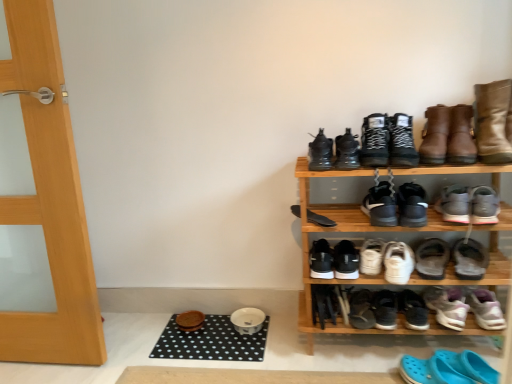
Question: Does gray suede sneakers at center right, the 13th footwear ordered from the bottom, contain blue rubber clogs at lower right, arranged as the 20th footwear when viewed from the top?

Choices:
 (A) yes
 (B) no

Answer: (B)

Question: Considering the relative sizes of gray suede sneakers at center right, the 13th footwear ordered from the bottom, and blue rubber clogs at lower right, arranged as the 20th footwear when viewed from the top, in the image provided, is gray suede sneakers at center right, the 13th footwear ordered from the bottom, smaller than blue rubber clogs at lower right, arranged as the 20th footwear when viewed from the top,?

Choices:
 (A) no
 (B) yes

Answer: (B)

Question: Considering the relative positions of gray suede sneakers at center right, which appears as the eighth footwear when viewed from the top, and blue rubber clogs at lower right, arranged as the 20th footwear when viewed from the top, in the image provided, is gray suede sneakers at center right, which appears as the eighth footwear when viewed from the top, to the right of blue rubber clogs at lower right, arranged as the 20th footwear when viewed from the top, from the viewer's perspective?

Choices:
 (A) no
 (B) yes

Answer: (B)

Question: Is gray suede sneakers at center right, the 13th footwear ordered from the bottom, positioned before blue rubber clogs at lower right, arranged as the 20th footwear when viewed from the top?

Choices:
 (A) yes
 (B) no

Answer: (B)

Question: Could you tell me if gray suede sneakers at center right, the 13th footwear ordered from the bottom, is facing blue rubber clogs at lower right, which is the 1th footwear from bottom to top?

Choices:
 (A) no
 (B) yes

Answer: (A)

Question: Is gray suede sneakers at center right, the 13th footwear ordered from the bottom, located outside blue rubber clogs at lower right, which is the 1th footwear from bottom to top?

Choices:
 (A) no
 (B) yes

Answer: (B)

Question: Is black matte shoe at lower center, the 14th footwear positioned from the top, shorter than leather boots at upper right, placed as the 20th footwear when sorted from bottom to top?

Choices:
 (A) yes
 (B) no

Answer: (A)

Question: Is leather boots at upper right, the first footwear positioned from the top, at the back of black matte shoe at lower center, the 14th footwear positioned from the top?

Choices:
 (A) no
 (B) yes

Answer: (A)

Question: From a real-world perspective, is black matte shoe at lower center, the 14th footwear positioned from the top, physically above leather boots at upper right, placed as the 20th footwear when sorted from bottom to top?

Choices:
 (A) yes
 (B) no

Answer: (B)

Question: Considering the relative sizes of black matte shoe at lower center, the seventh footwear when ordered from bottom to top, and leather boots at upper right, the first footwear positioned from the top, in the image provided, is black matte shoe at lower center, the seventh footwear when ordered from bottom to top, wider than leather boots at upper right, the first footwear positioned from the top,?

Choices:
 (A) yes
 (B) no

Answer: (B)

Question: Can you confirm if black matte shoe at lower center, the 14th footwear positioned from the top, is thinner than leather boots at upper right, placed as the 20th footwear when sorted from bottom to top?

Choices:
 (A) no
 (B) yes

Answer: (B)

Question: From a real-world perspective, does black matte shoe at lower center, the 14th footwear positioned from the top, sit lower than leather boots at upper right, placed as the 20th footwear when sorted from bottom to top?

Choices:
 (A) yes
 (B) no

Answer: (A)

Question: From a real-world perspective, is black leather sneakers at upper center, which ranks as the second footwear in top-to-bottom order, under black matte sneakers at center, arranged as the 15th footwear when ordered from the bottom?

Choices:
 (A) yes
 (B) no

Answer: (B)